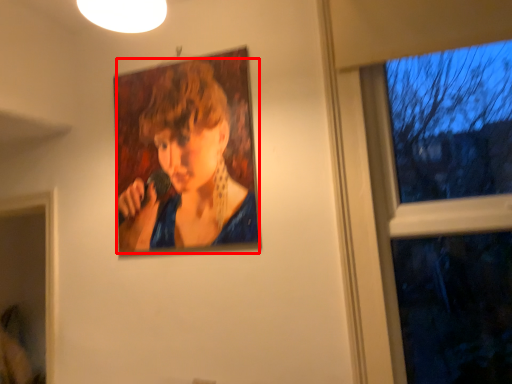
Question: From the image, what is the correct spatial relationship of person (annotated by the red box) in relation to window?

Choices:
 (A) right
 (B) left

Answer: (B)